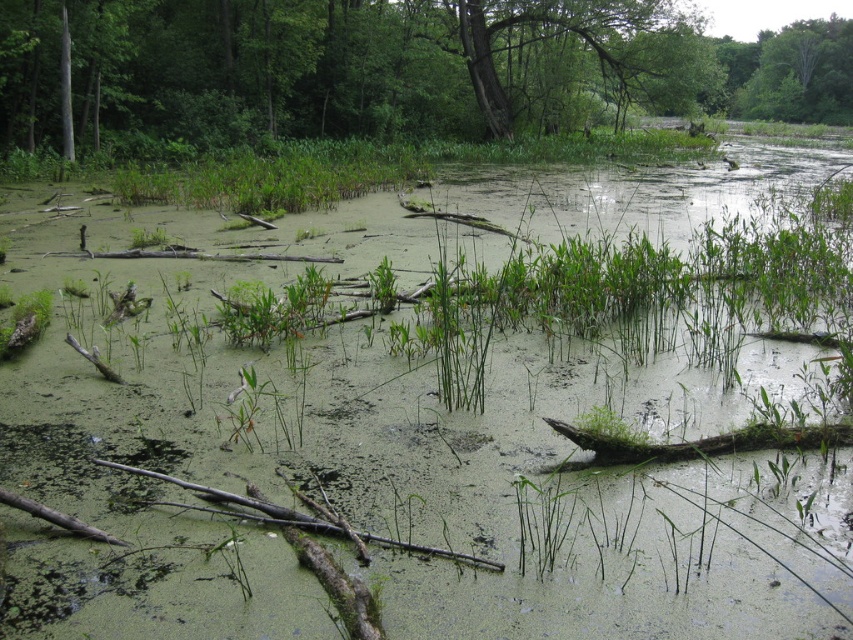
You are a bird looking for a nesting spot. The smooth bark tree at center and the green rough bark tree at upper center are both potential options. Which tree is taller and would provide a better vantage point?

The smooth bark tree at center is taller than the green rough bark tree at upper center, so it would provide a better vantage point for nesting.

You are a hiker trying to determine which tree to rest against. The smooth bark tree at center and the green rough bark tree at upper center are both visible. Which tree has a larger size?

The smooth bark tree at center is bigger than the green rough bark tree at upper center, so you should choose the smooth bark tree at center for resting as it offers a larger surface area.

You are a bird flying over the marshy wetland. You see the smooth bark tree at center and the green rough bark tree at upper center. Which tree would you land on first if you are approaching from above?

You would land on the smooth bark tree at center first because it is closer to you than the green rough bark tree at upper center, which is further away.